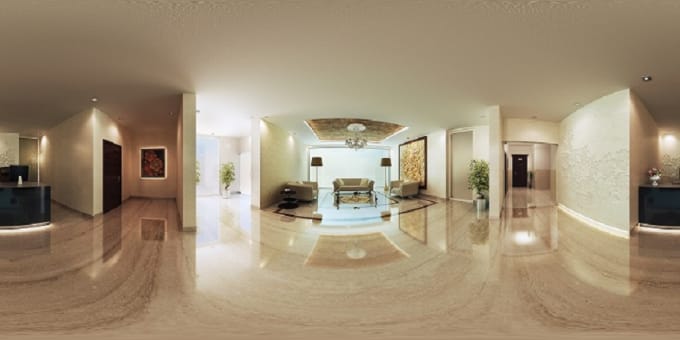
Where is `ceiling`? The image size is (680, 340). ceiling is located at coordinates (354, 36).